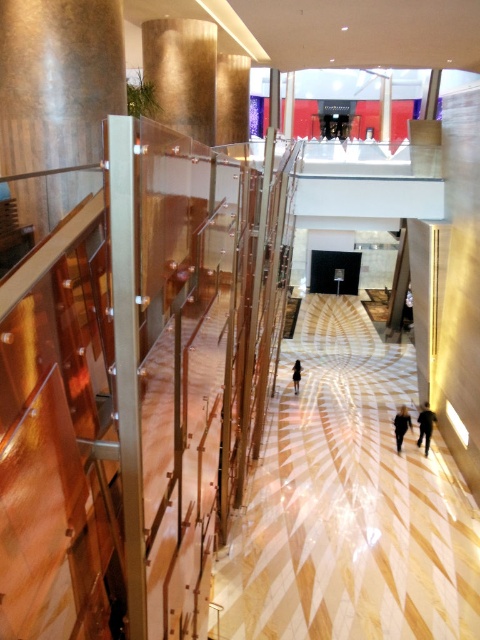
Where is `white glossy floor at center`? The image size is (480, 640). white glossy floor at center is located at coordinates (348, 502).

Can you confirm if white glossy floor at center is shorter than dark brown leather jacket at center?

No.

Locate an element on the screen. The height and width of the screenshot is (640, 480). white glossy floor at center is located at coordinates (348, 502).

Locate an element on the screen. white glossy floor at center is located at coordinates (348, 502).

Who is more distant from viewer, [429,436] or [394,426]?

The point [394,426] is more distant.

Is dark gray fabric person at lower right closer to camera compared to blurred black clothing at center?

Yes, it is.

Is point (421, 440) farther from viewer compared to point (403, 429)?

Yes, point (421, 440) is behind point (403, 429).

The height and width of the screenshot is (640, 480). I want to click on dark gray fabric person at lower right, so click(x=425, y=426).

Does point (336, 424) come farther from viewer compared to point (403, 417)?

Yes, point (336, 424) is farther from viewer.

Is white glossy floor at center to the left of blurred black clothing at center from the viewer's perspective?

Yes, white glossy floor at center is to the left of blurred black clothing at center.

Does point (248, 586) lie in front of point (402, 422)?

Yes, point (248, 586) is closer to viewer.

Locate an element on the screen. The width and height of the screenshot is (480, 640). white glossy floor at center is located at coordinates (348, 502).